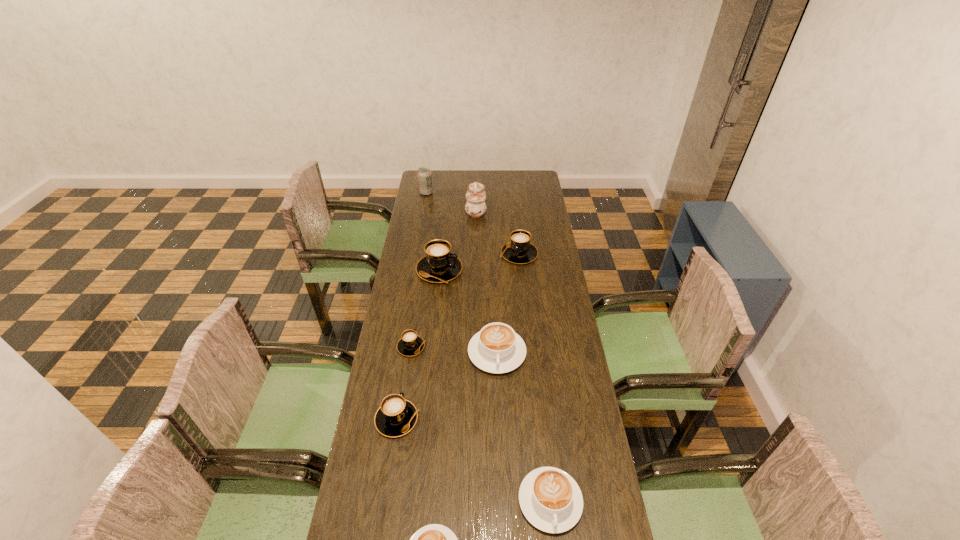
You are a GUI agent. You are given a task and a screenshot of the screen. Output one action in this format:
    pyautogui.click(x=<x>, y=<y>)
    Task: Click on the object located in the far left corner section of the desktop
    The image size is (960, 540).
    Given the screenshot: What is the action you would take?
    pyautogui.click(x=424, y=174)

What are the coordinates of `vacant space at the far edge of the desktop` in the screenshot? It's located at (449, 175).

The image size is (960, 540). I want to click on vacant space at the left edge of the desktop, so click(x=387, y=339).

Image resolution: width=960 pixels, height=540 pixels. In the image, there is a desktop. Find the location of `vacant space at the right edge`. vacant space at the right edge is located at coordinates (560, 287).

You are a GUI agent. You are given a task and a screenshot of the screen. Output one action in this format:
    pyautogui.click(x=<x>, y=<y>)
    Task: Click on the free spot between the second smallest white cappuccino and the smallest black cappuccino
    
    Given the screenshot: What is the action you would take?
    pyautogui.click(x=481, y=424)

The height and width of the screenshot is (540, 960). Find the location of `vacant space that's between the biggest black cappuccino and the rightmost black cappuccino`. vacant space that's between the biggest black cappuccino and the rightmost black cappuccino is located at coordinates (479, 262).

I want to click on vacant area that lies between the nearest black cappuccino and the third smallest black cappuccino, so click(458, 336).

Locate an element on the screen. The image size is (960, 540). empty location between the farthest white cappuccino and the rightmost black cappuccino is located at coordinates (508, 303).

Locate an element on the screen. vacant space in between the second farthest object and the farthest object is located at coordinates (451, 201).

Find the location of a particular element. This screenshot has width=960, height=540. free space between the second nearest black cappuccino and the fifth farthest cappuccino is located at coordinates (404, 383).